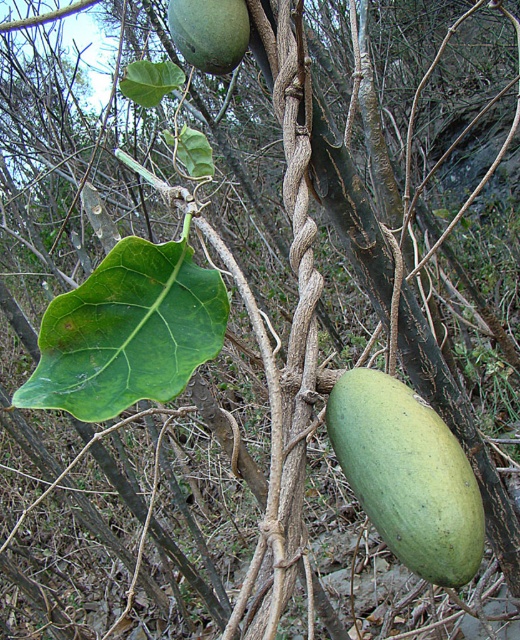
Is green smooth leaf at center bigger than green matte/glossy gourd at center-right?

Yes, green smooth leaf at center is bigger than green matte/glossy gourd at center-right.

Which is above, green smooth leaf at center or green matte/glossy gourd at center-right?

green smooth leaf at center is above.

Is point (196, 289) farther from camera compared to point (359, 499)?

Yes, point (196, 289) is behind point (359, 499).

Image resolution: width=520 pixels, height=640 pixels. I want to click on green smooth leaf at center, so click(127, 332).

Does green matte/glossy gourd at center-right lie in front of green matte/glossy fruit at upper center?

Yes.

Is green matte/glossy gourd at center-right positioned behind green matte/glossy fruit at upper center?

No.

Between point (370, 419) and point (172, 35), which one is positioned in front?

Positioned in front is point (370, 419).

What are the coordinates of `green matte/glossy gourd at center-right` in the screenshot? It's located at (408, 476).

Where is `green smooth leaf at center`? The image size is (520, 640). green smooth leaf at center is located at coordinates (127, 332).